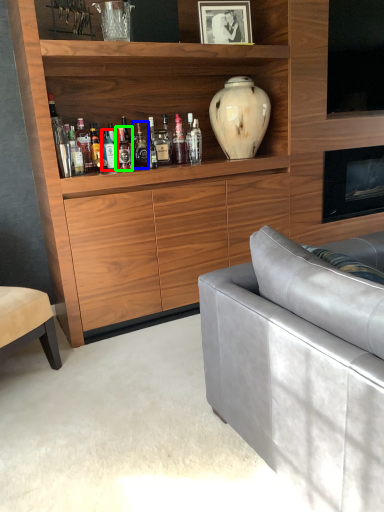
Question: Which object is the farthest from bottle (highlighted by a red box)? Choose among these: bottle (highlighted by a blue box) or bottle (highlighted by a green box).

Choices:
 (A) bottle
 (B) bottle

Answer: (A)